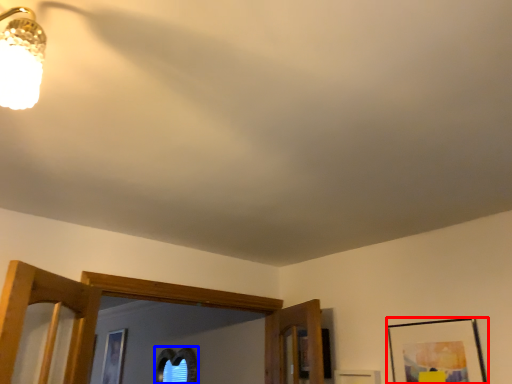
Question: Among these objects, which one is farthest to the camera, picture frame (highlighted by a red box) or picture (highlighted by a blue box)?

Choices:
 (A) picture frame
 (B) picture

Answer: (B)